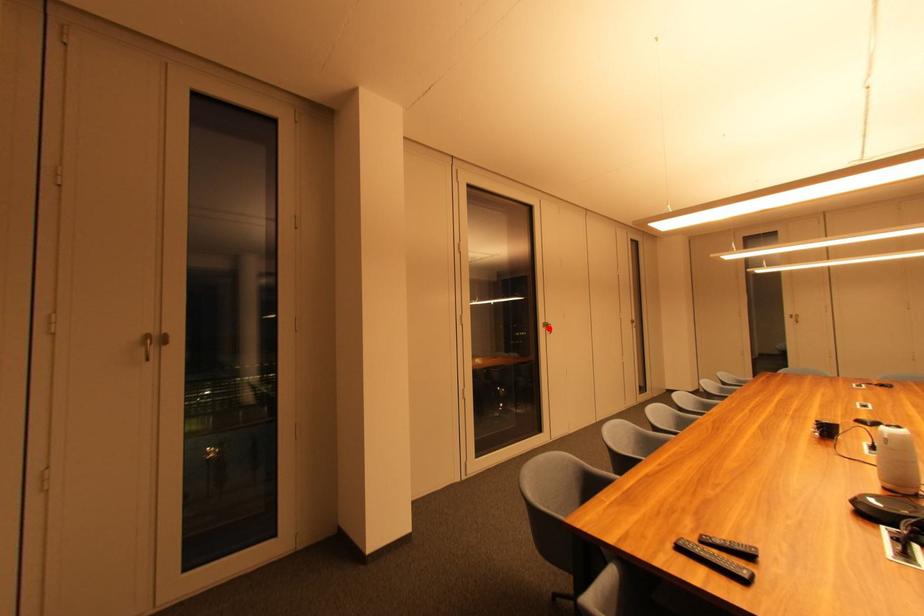
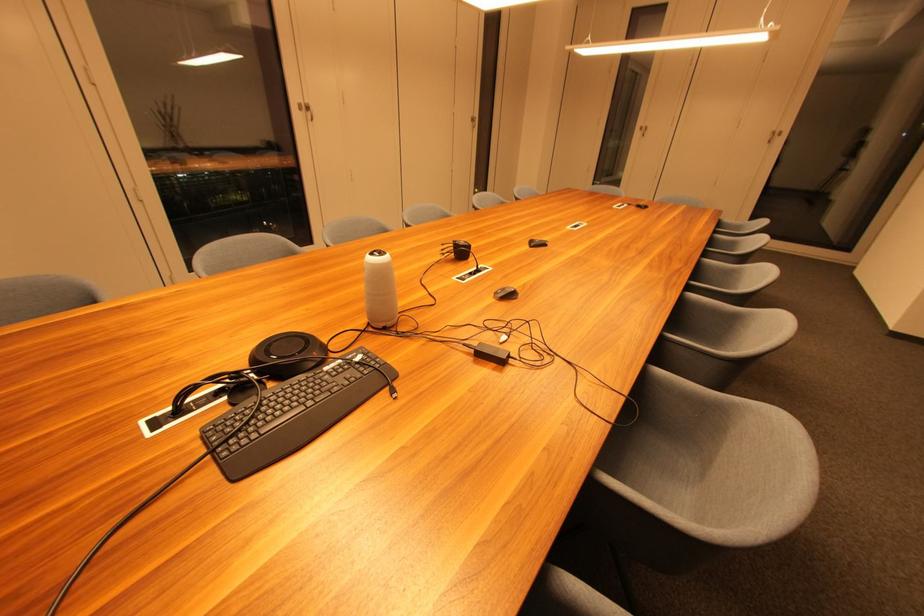
In the second image, find the point that corresponds to the highlighted location in the first image.

(306, 111)